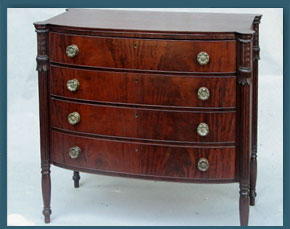
The image size is (290, 229). Identify the location of fourth drawer. (139, 152).